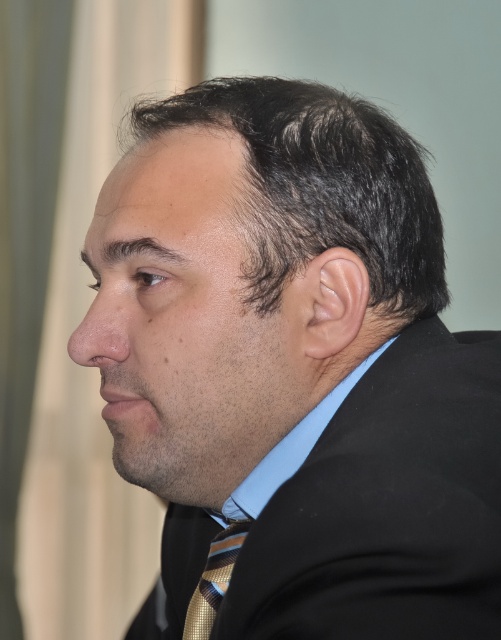
Question: Which of the following is the closest to the observer?

Choices:
 (A) (319, 291)
 (B) (124, 353)

Answer: (A)

Question: In this image, where is smooth skin ear at center located relative to smooth skin nose at center?

Choices:
 (A) below
 (B) above

Answer: (B)

Question: Does dark brown hair at center have a larger size compared to striped silk tie at center?

Choices:
 (A) yes
 (B) no

Answer: (A)

Question: Is smooth skin nose at center above striped silk tie at center?

Choices:
 (A) yes
 (B) no

Answer: (A)

Question: Which of these objects is positioned closest to the striped silk tie at center?

Choices:
 (A) dark brown hair at center
 (B) smooth skin ear at center

Answer: (B)

Question: Which point is farther to the camera?

Choices:
 (A) striped silk tie at center
 (B) dark brown hair at center
 (C) smooth skin ear at center

Answer: (A)